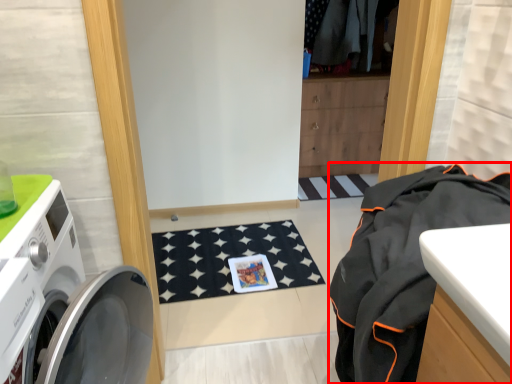
Question: From the image's perspective, considering the relative positions of clothing (annotated by the red box) and washing machine in the image provided, where is clothing (annotated by the red box) located with respect to the staircase?

Choices:
 (A) below
 (B) above

Answer: (B)